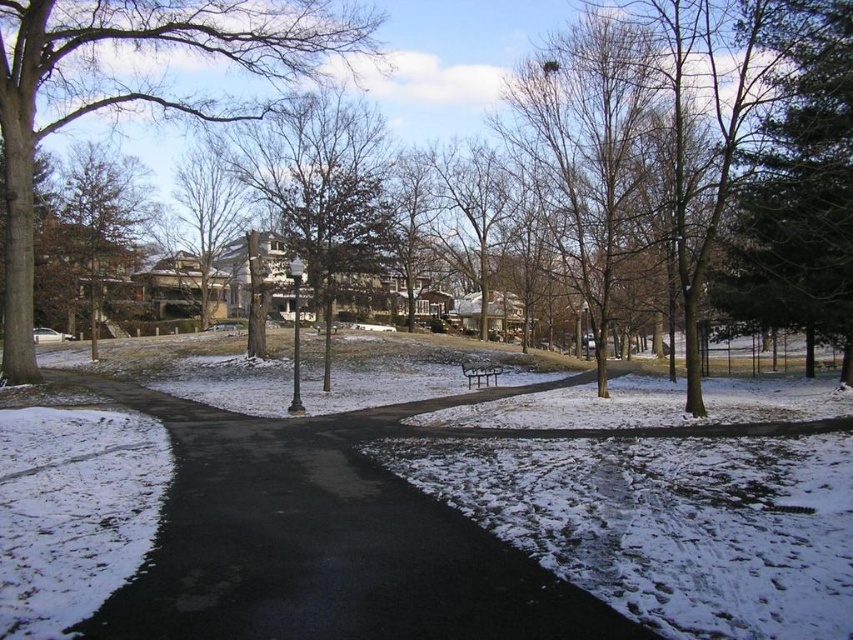
Question: Where is dark green textured evergreen tree at right located in relation to brown textured tree at upper center in the image?

Choices:
 (A) above
 (B) below

Answer: (B)

Question: Which object is closer to the camera taking this photo?

Choices:
 (A) dark green textured evergreen tree at right
 (B) brown textured tree at upper left

Answer: (A)

Question: Considering the real-world distances, which object is farthest from the brown textured tree at upper center?

Choices:
 (A) dark green textured evergreen tree at right
 (B) brown textured tree at center

Answer: (A)

Question: Which point is farther to the camera?

Choices:
 (A) (170, 236)
 (B) (300, 129)
 (C) (3, 116)

Answer: (A)

Question: Can you confirm if black asphalt path at center is wider than brown textured tree at center?

Choices:
 (A) yes
 (B) no

Answer: (B)

Question: Can you confirm if green matte tree at upper left is thinner than brown textured tree at upper center?

Choices:
 (A) yes
 (B) no

Answer: (A)